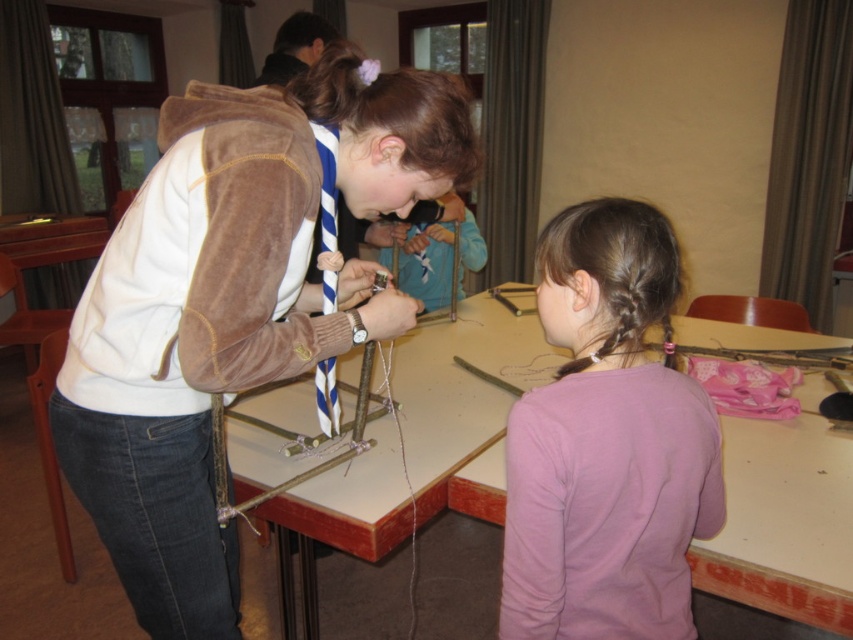
Does pink matte shirt at center appear over wooden table at center?

Yes.

Can you confirm if pink matte shirt at center is taller than wooden table at center?

Yes, pink matte shirt at center is taller than wooden table at center.

Identify the location of pink matte shirt at center. (607, 442).

Find the location of a particular element. The height and width of the screenshot is (640, 853). pink matte shirt at center is located at coordinates (607, 442).

The width and height of the screenshot is (853, 640). Describe the element at coordinates (233, 304) in the screenshot. I see `brown suede jacket at upper left` at that location.

Does brown suede jacket at upper left have a lesser width compared to pink matte shirt at center?

In fact, brown suede jacket at upper left might be wider than pink matte shirt at center.

This screenshot has width=853, height=640. Identify the location of brown suede jacket at upper left. (233, 304).

Who is taller, brown suede jacket at upper left or wooden table at center?

Standing taller between the two is brown suede jacket at upper left.

Between point (155, 266) and point (738, 339), which one is positioned in front?

Point (155, 266)

This screenshot has width=853, height=640. Identify the location of brown suede jacket at upper left. (233, 304).